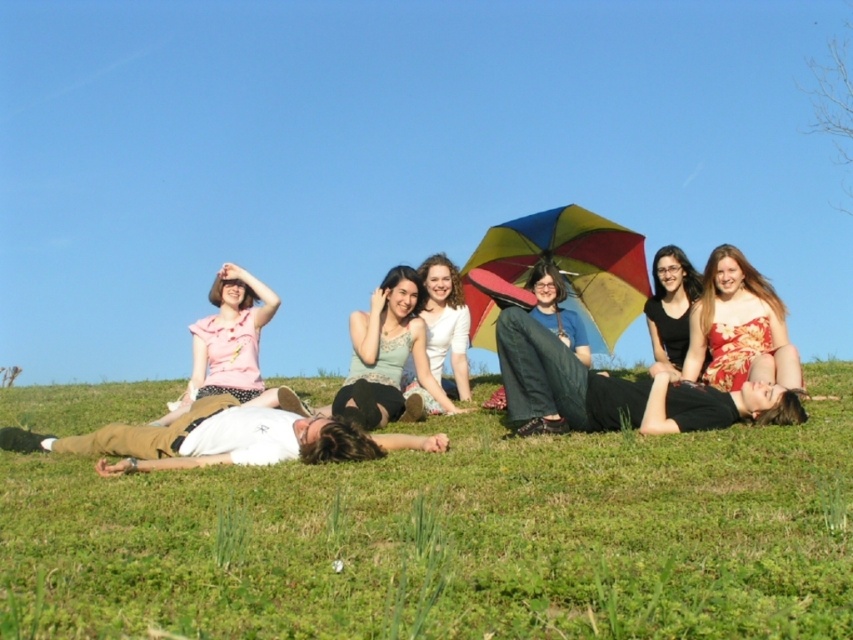
You are standing at the location of the matte pink blouse at left and want to throw a frisbee to your friend wearing the blue cotton shirt at center. If the frisbee can travel 3 meters, will it reach them?

The distance between the matte pink blouse at left and the blue cotton shirt at center is 3.57 meters, which is longer than the frisbee can travel. The frisbee will not reach them.

You are a photographer taking a picture of the group. You notice the black matte dress at center and the blue cotton shirt at center. Which clothing item is positioned lower in the image?

The black matte dress at center is located below the blue cotton shirt at center, so it is positioned lower in the image.